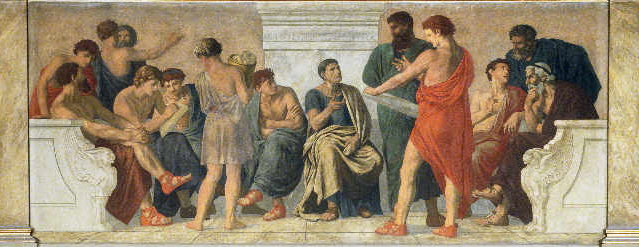
Locate an element on the screen. Image resolution: width=639 pixels, height=247 pixels. floor is located at coordinates (337, 231).